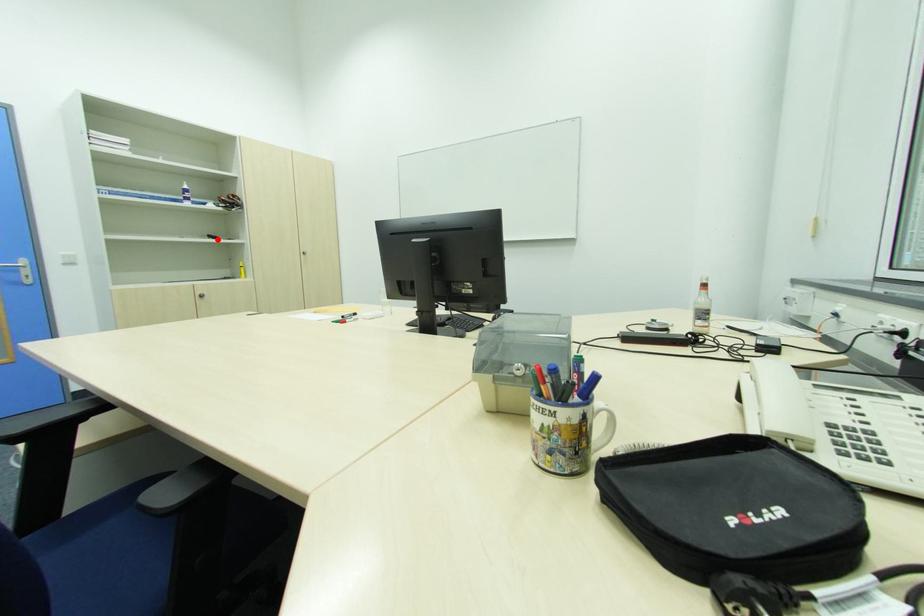
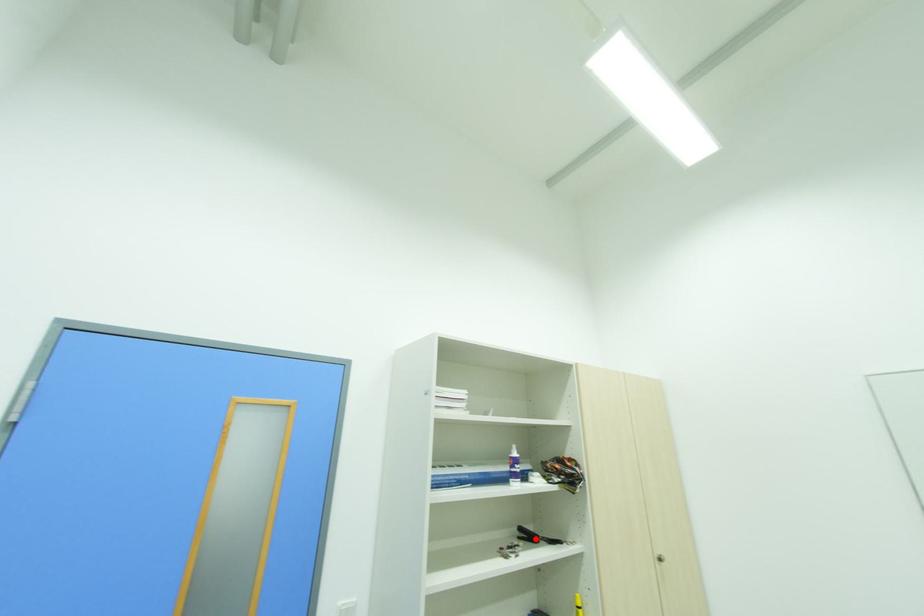
I am providing you with two images of the same scene from different viewpoints. A red point is marked on the first image and another point is marked on the second image. Does the point marked in image1 correspond to the same location as the one in image2?

Yes